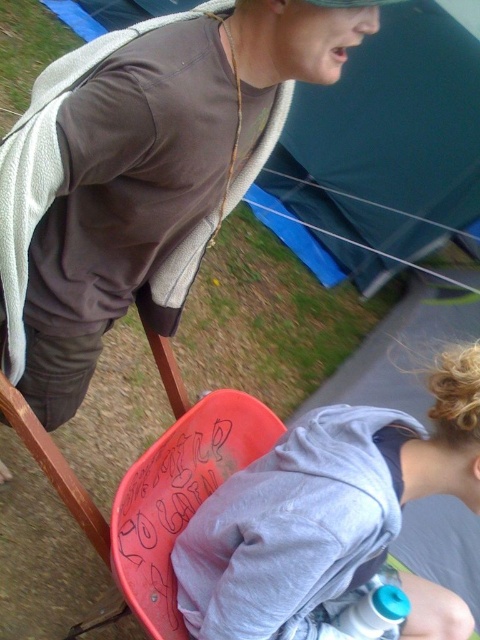
Question: Which object is farther from the camera taking this photo?

Choices:
 (A) matte brown hoodie at upper left
 (B) gray cotton hoodie at lower right
 (C) blue translucent bottle at lower center

Answer: (C)

Question: Considering the relative positions of matte brown hoodie at upper left and gray cotton hoodie at lower right in the image provided, where is matte brown hoodie at upper left located with respect to gray cotton hoodie at lower right?

Choices:
 (A) right
 (B) left

Answer: (B)

Question: Which point is closer to the camera?

Choices:
 (A) (368, 627)
 (B) (101, 211)
 (C) (464, 477)

Answer: (B)

Question: Does matte brown hoodie at upper left appear on the left side of gray cotton hoodie at lower right?

Choices:
 (A) no
 (B) yes

Answer: (B)

Question: Which of the following is the closest to the observer?

Choices:
 (A) (73, 310)
 (B) (231, 582)

Answer: (B)

Question: Does gray cotton hoodie at lower right appear on the left side of blue translucent bottle at lower center?

Choices:
 (A) yes
 (B) no

Answer: (A)